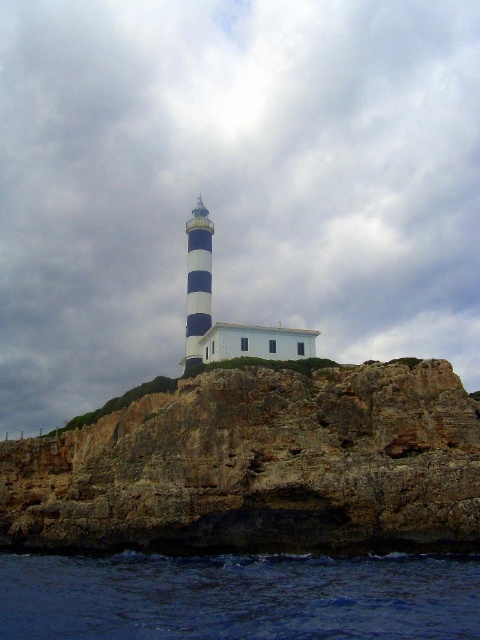
Between dark blue water at lower left and blue and white striped lighthouse at center, which one is positioned lower?

dark blue water at lower left is lower down.

Is point (321, 605) more distant than point (201, 298)?

No, it is in front of (201, 298).

At what (x,y) coordinates should I click in order to perform the action: click on dark blue water at lower left. Please return your answer as a coordinate pair (x, y). Image resolution: width=480 pixels, height=640 pixels. Looking at the image, I should click on (239, 596).

Can you confirm if rugged stone cliff at center is positioned above dark blue water at lower left?

Yes, rugged stone cliff at center is above dark blue water at lower left.

Between rugged stone cliff at center and dark blue water at lower left, which one is positioned higher?

rugged stone cliff at center

At what (x,y) coordinates should I click in order to perform the action: click on rugged stone cliff at center. Please return your answer as a coordinate pair (x, y). This screenshot has width=480, height=640. Looking at the image, I should click on tap(259, 467).

Locate an element on the screen. This screenshot has height=640, width=480. rugged stone cliff at center is located at coordinates (259, 467).

Can you confirm if rugged stone cliff at center is positioned below blue and white striped lighthouse at center?

Yes, rugged stone cliff at center is below blue and white striped lighthouse at center.

What do you see at coordinates (259, 467) in the screenshot? This screenshot has width=480, height=640. I see `rugged stone cliff at center` at bounding box center [259, 467].

Locate an element on the screen. The image size is (480, 640). rugged stone cliff at center is located at coordinates (259, 467).

Where is `rugged stone cliff at center`? rugged stone cliff at center is located at coordinates (259, 467).